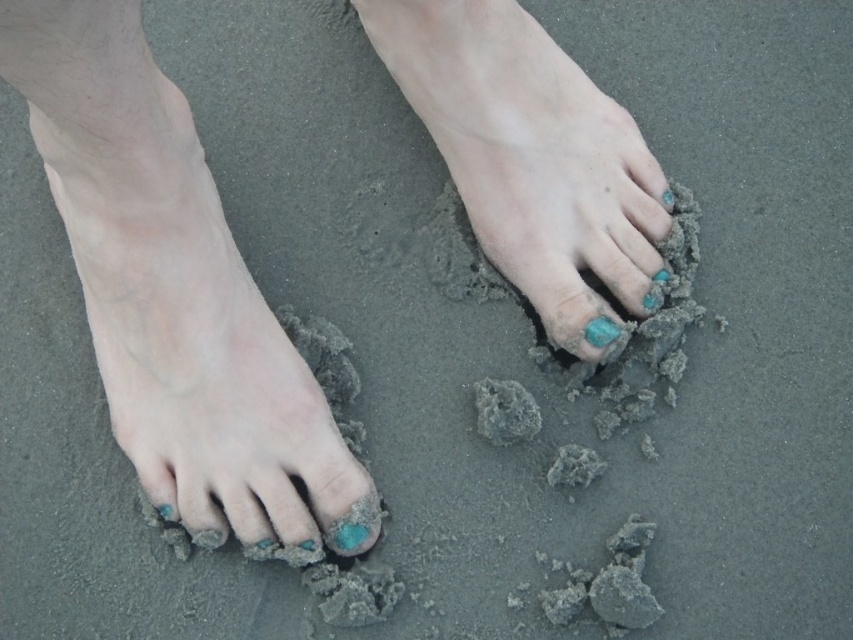
Question: Can you confirm if teal matte nails at center is positioned above matte skin foot at left?

Choices:
 (A) no
 (B) yes

Answer: (B)

Question: Which object is the farthest from the matte turquoise nail polish at center?

Choices:
 (A) matte skin foot at left
 (B) teal polished nails at center
 (C) teal matte nails at center
 (D) matte turquoise stone at center

Answer: (B)

Question: Observing the image, what is the correct spatial positioning of teal matte nails at center in reference to matte skin foot at left?

Choices:
 (A) below
 (B) above

Answer: (B)

Question: Which point is closer to the camera?

Choices:
 (A) teal matte nails at center
 (B) teal matte nail at center
 (C) matte turquoise stone at center
 (D) teal polished nails at center

Answer: (A)

Question: Which point appears farthest from the camera in this image?

Choices:
 (A) (270, 464)
 (B) (132, 305)
 (C) (608, 340)
 (D) (345, 536)

Answer: (C)

Question: Does teal polished nails at center appear over teal matte nail at center?

Choices:
 (A) yes
 (B) no

Answer: (A)